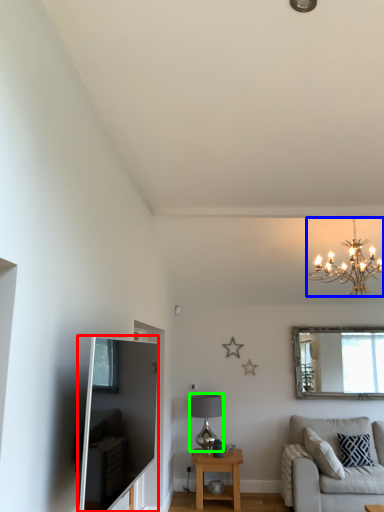
Question: Estimate the real-world distances between objects in this image. Which object is farther from entertainment center (highlighted by a red box), light fixture (highlighted by a blue box) or lamp (highlighted by a green box)?

Choices:
 (A) light fixture
 (B) lamp

Answer: (B)